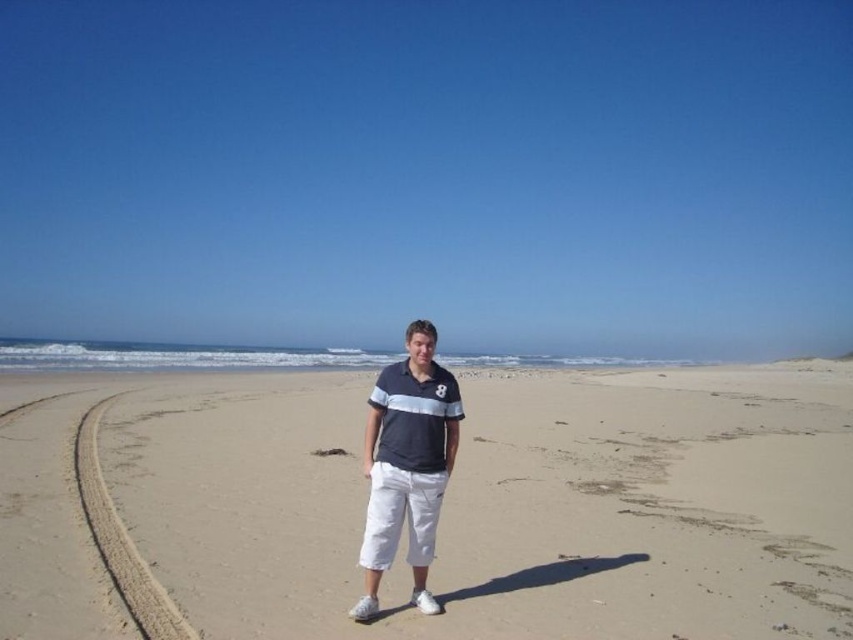
The height and width of the screenshot is (640, 853). What do you see at coordinates (451, 506) in the screenshot?
I see `sandy at center` at bounding box center [451, 506].

Can you confirm if sandy at center is smaller than matte blue shirt at center?

No.

Between point (819, 522) and point (422, 572), which one is positioned behind?

Positioned behind is point (819, 522).

Find the location of a particular element. The height and width of the screenshot is (640, 853). sandy at center is located at coordinates (451, 506).